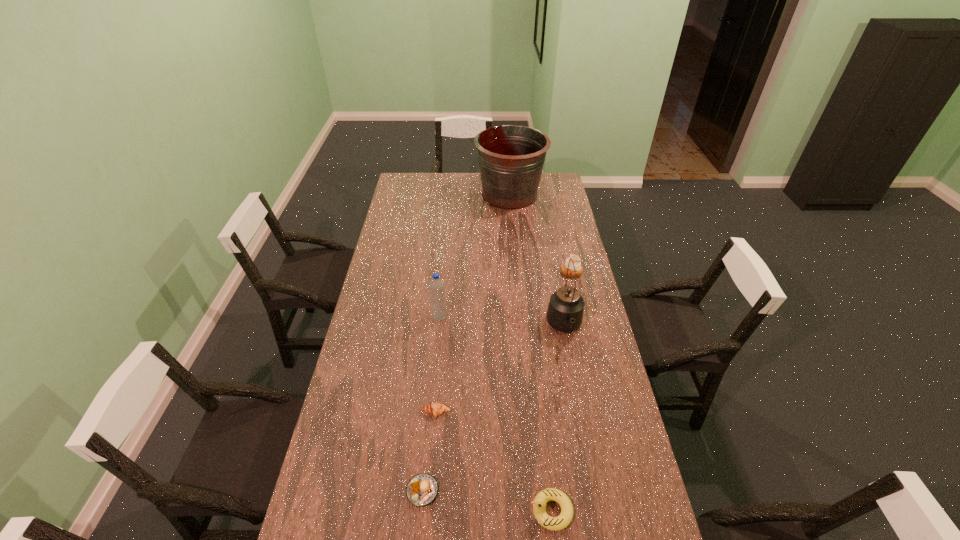
Find the location of `vacant position in the image that satisfies the following two spatial constraints: 1. on the back side of the water bottle; 2. on the left side of the nearest pastry`. vacant position in the image that satisfies the following two spatial constraints: 1. on the back side of the water bottle; 2. on the left side of the nearest pastry is located at coordinates (439, 316).